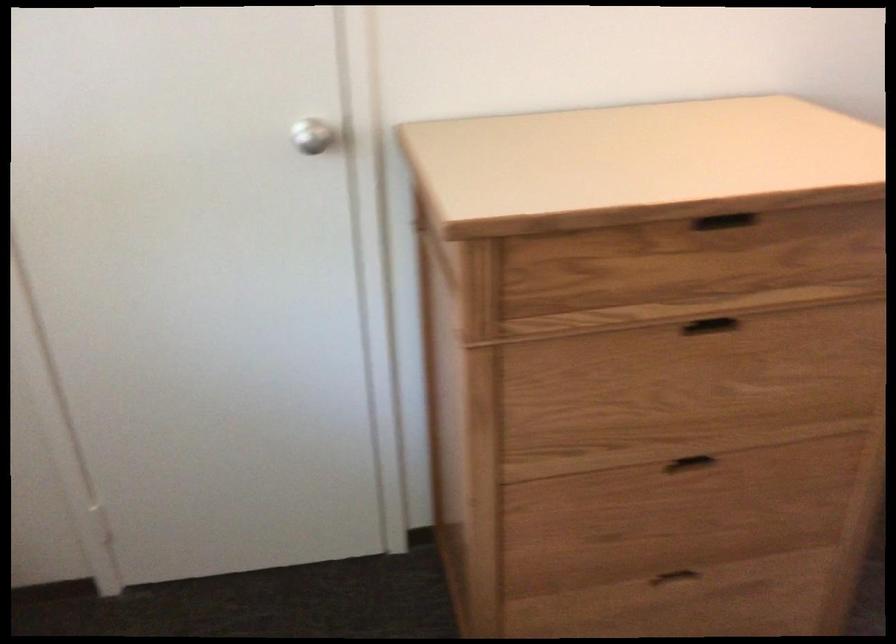
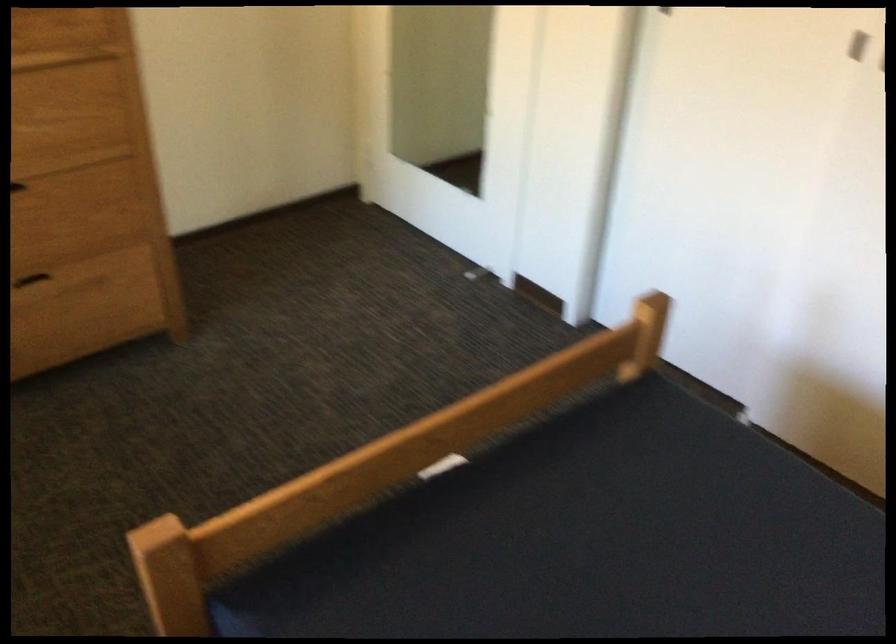
What movement of the cameraman would produce the second image?

The movement direction of the cameraman is right, backward.